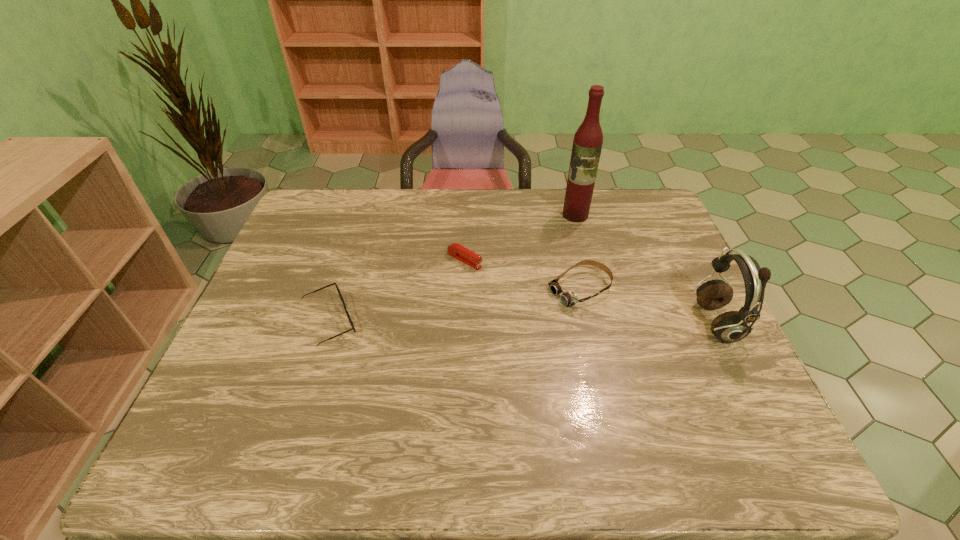
The image size is (960, 540). Identify the location of vacant space located 0.070m on the label of the liquor. (569, 235).

At what (x,y) coordinates should I click in order to perform the action: click on vacant space located 0.080m on the label of the liquor. Please return your answer as a coordinate pair (x, y). This screenshot has width=960, height=540. Looking at the image, I should click on (569, 237).

The width and height of the screenshot is (960, 540). I want to click on free location located on the front-facing side of the goggles, so click(x=540, y=308).

This screenshot has width=960, height=540. What are the coordinates of `vacant space positioned on the front-facing side of the goggles` in the screenshot? It's located at (520, 317).

Identify the location of vacant space located on the front-facing side of the goggles. (511, 322).

You are a GUI agent. You are given a task and a screenshot of the screen. Output one action in this format:
    pyautogui.click(x=<x>, y=<y>)
    Task: Click on the vacant space located on the front-facing side of the fourth object from right to left
    The width and height of the screenshot is (960, 540).
    Given the screenshot: What is the action you would take?
    pyautogui.click(x=582, y=322)

Locate an element on the screen. This screenshot has width=960, height=540. blank space located 0.340m on the front-facing side of the fourth object from right to left is located at coordinates (582, 322).

Find the location of `vacant space located on the front-facing side of the fourth object from right to left`. vacant space located on the front-facing side of the fourth object from right to left is located at coordinates point(530,294).

Where is `object at the far edge`? object at the far edge is located at coordinates (587, 144).

Identify the location of object that is positioned at the left edge. (349, 318).